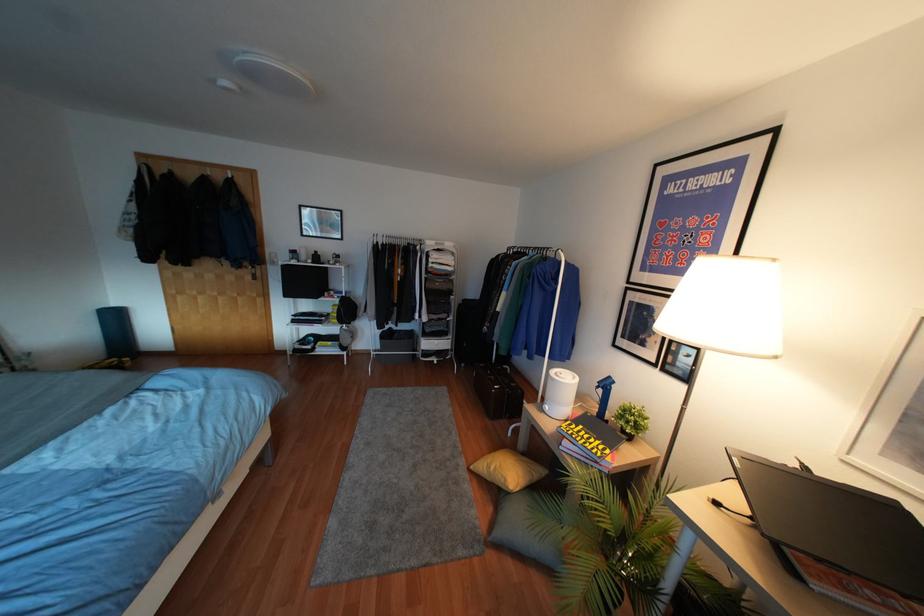
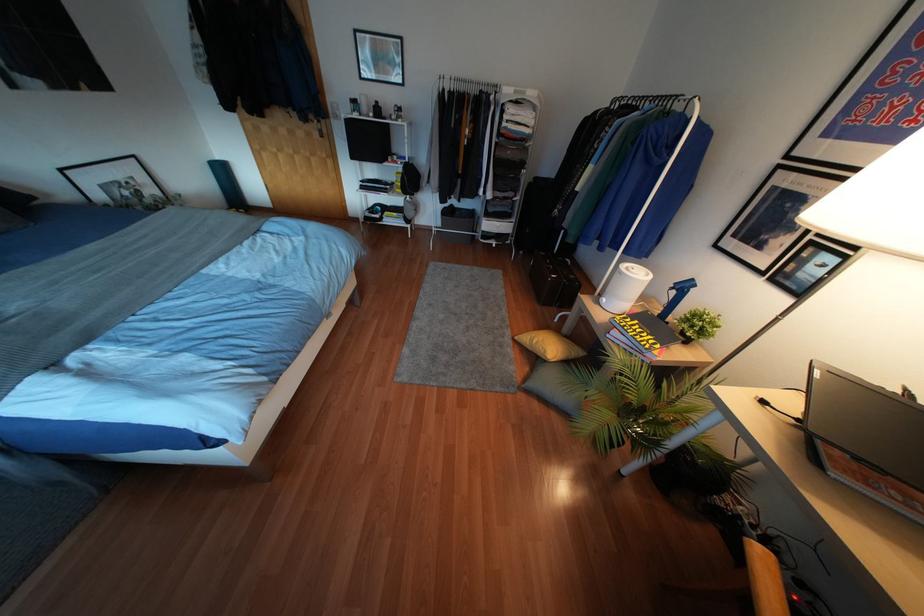
Find the pixel in the second image that matches (554,373) in the first image.

(626, 268)